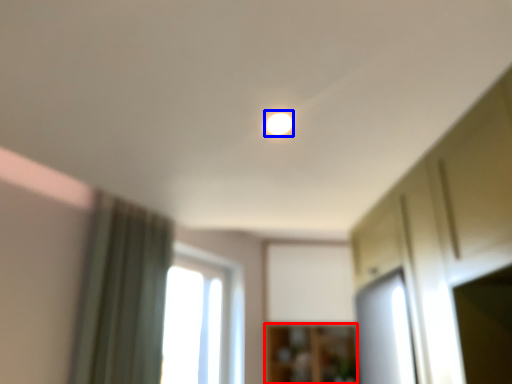
Question: Which of the following is the closest to the observer, cabinetry (highlighted by a red box) or light (highlighted by a blue box)?

Choices:
 (A) cabinetry
 (B) light

Answer: (B)